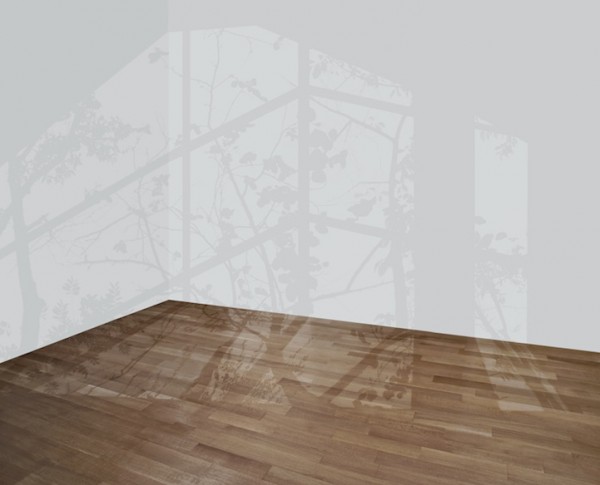
Find the location of a particular element. Image resolution: width=600 pixels, height=485 pixels. trim between window panes being reflected is located at coordinates (186, 150).